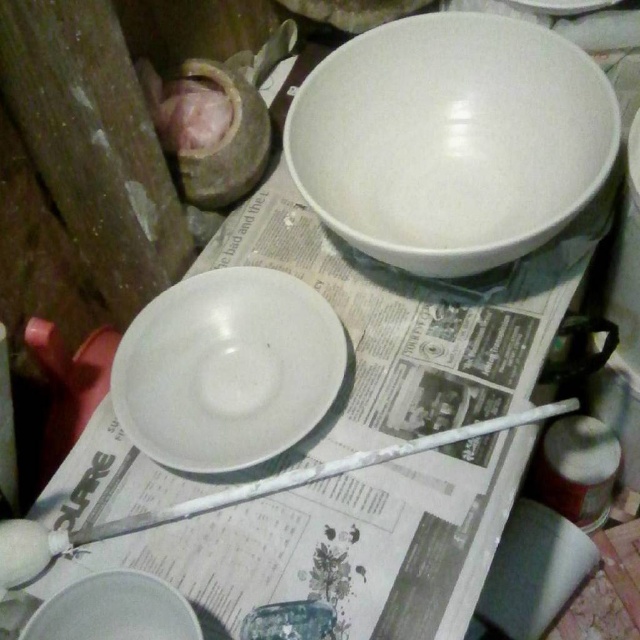
Question: Is white glossy bowl at upper center above matte white bowl at lower left?

Choices:
 (A) yes
 (B) no

Answer: (A)

Question: Among these points, which one is farthest from the camera?

Choices:
 (A) (605, 454)
 (B) (284, 323)
 (C) (125, 600)

Answer: (A)

Question: Estimate the real-world distances between objects in this image. Which object is closer to the white glossy bowl at upper center?

Choices:
 (A) white glossy plate at center
 (B) matte white jar at lower right
 (C) matte white bowl at lower left

Answer: (A)

Question: Which point is closer to the camera?

Choices:
 (A) white glossy plate at center
 (B) white glossy bowl at upper center

Answer: (B)

Question: Is white glossy plate at center wider than matte white jar at lower right?

Choices:
 (A) yes
 (B) no

Answer: (A)

Question: In this image, where is white glossy bowl at upper center located relative to matte white jar at lower right?

Choices:
 (A) right
 (B) left

Answer: (B)